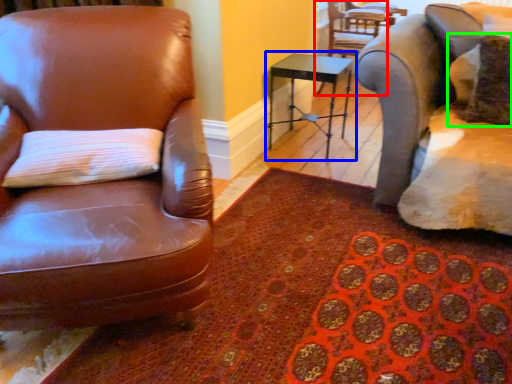
Question: Considering the real-world distances, which object is closest to chair (highlighted by a red box)? table (highlighted by a blue box) or pillow (highlighted by a green box).

Choices:
 (A) table
 (B) pillow

Answer: (A)